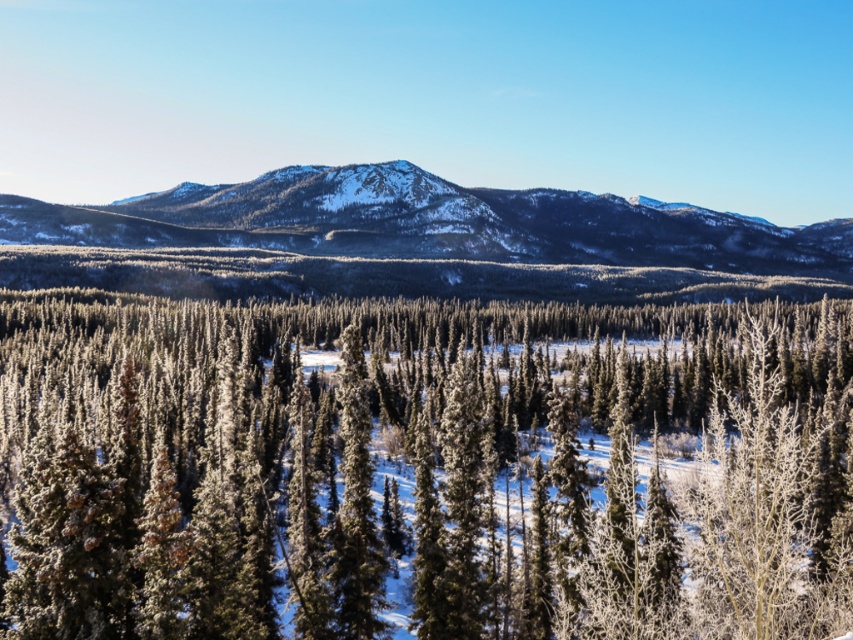
Can you confirm if snow-covered evergreen trees at center is smaller than snowy rocky mountain at center?

Yes, snow-covered evergreen trees at center is smaller than snowy rocky mountain at center.

Can you confirm if snow-covered evergreen trees at center is taller than snowy rocky mountain at center?

No, snow-covered evergreen trees at center is not taller than snowy rocky mountain at center.

Between point (633, 339) and point (776, 232), which one is positioned in front?

Point (633, 339)

Locate an element on the screen. This screenshot has height=640, width=853. snow-covered evergreen trees at center is located at coordinates (422, 468).